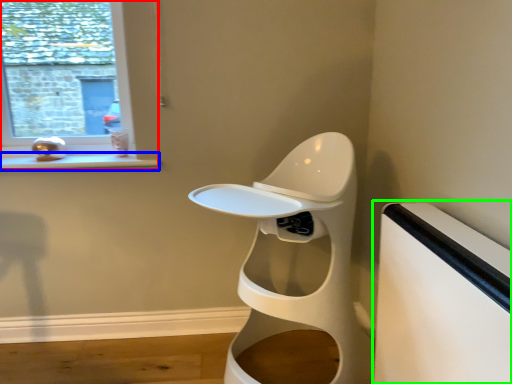
Question: Which object is the farthest from window (highlighted by a red box)? Choose among these: window sill (highlighted by a blue box) or table (highlighted by a green box).

Choices:
 (A) window sill
 (B) table

Answer: (B)